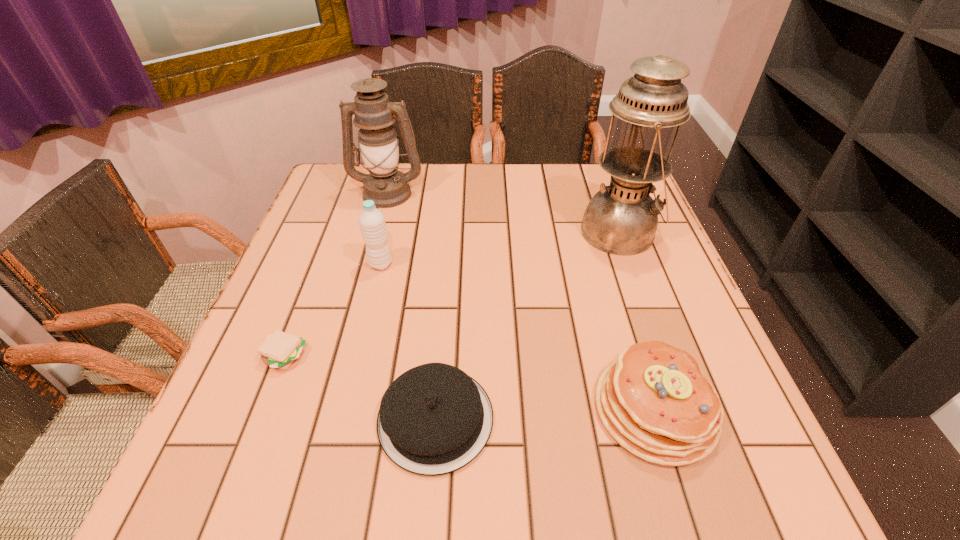
Find the location of a particular element. The image size is (960, 540). free space that is in between the patty and the shorter pancake is located at coordinates (361, 388).

Where is `vacant area between the farthest object and the shortest object`? The width and height of the screenshot is (960, 540). vacant area between the farthest object and the shortest object is located at coordinates (336, 275).

At what (x,y) coordinates should I click in order to perform the action: click on free spot between the fourth nearest object and the fifth tallest object. Please return your answer as a coordinate pair (x, y). The width and height of the screenshot is (960, 540). Looking at the image, I should click on (408, 342).

You are a GUI agent. You are given a task and a screenshot of the screen. Output one action in this format:
    pyautogui.click(x=<x>, y=<y>)
    Task: Click on the free spot between the farthest object and the shortest object
    
    Given the screenshot: What is the action you would take?
    pyautogui.click(x=336, y=275)

Image resolution: width=960 pixels, height=540 pixels. In order to click on free space between the shorter pancake and the shortest object in this screenshot , I will do `click(361, 388)`.

Locate which object ranks third in proximity to the fifth tallest object. Please provide its 2D coordinates. Your answer should be formatted as a tuple, i.e. [(x, y)], where the tuple contains the x and y coordinates of a point satisfying the conditions above.

[(372, 224)]

Choose which object is the fifth nearest neighbor to the water bottle. Please provide its 2D coordinates. Your answer should be formatted as a tuple, i.e. [(x, y)], where the tuple contains the x and y coordinates of a point satisfying the conditions above.

[(654, 401)]

In order to click on vacant point that satisfies the following two spatial constraints: 1. on the front side of the right pancake; 2. on the left side of the farthest object in this screenshot , I will do `click(329, 409)`.

Identify the location of free location that satisfies the following two spatial constraints: 1. on the front side of the shorter pancake; 2. on the left side of the farthest object. (326, 419).

Locate an element on the screen. Image resolution: width=960 pixels, height=540 pixels. free space that satisfies the following two spatial constraints: 1. on the back side of the left pancake; 2. on the right side of the nearer oil lamp is located at coordinates (450, 232).